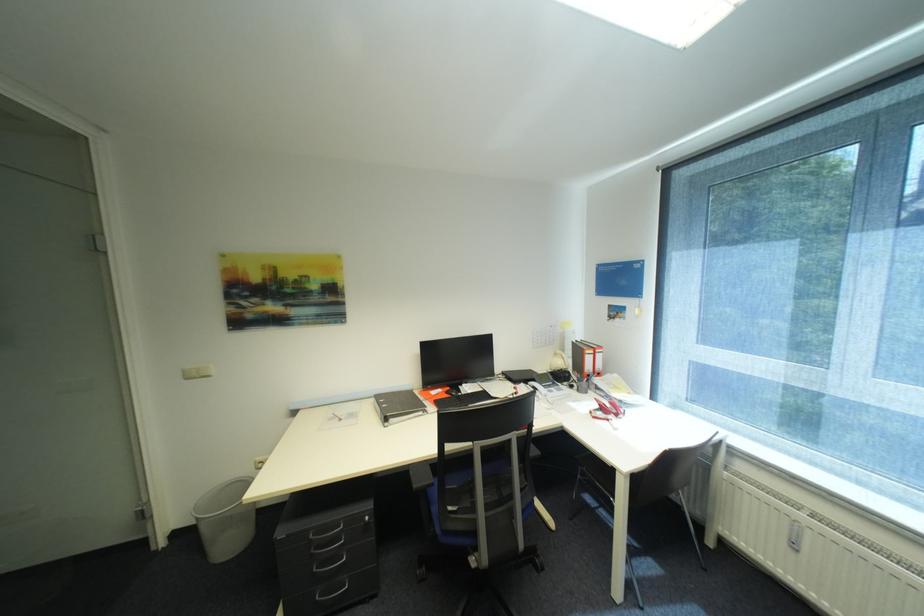
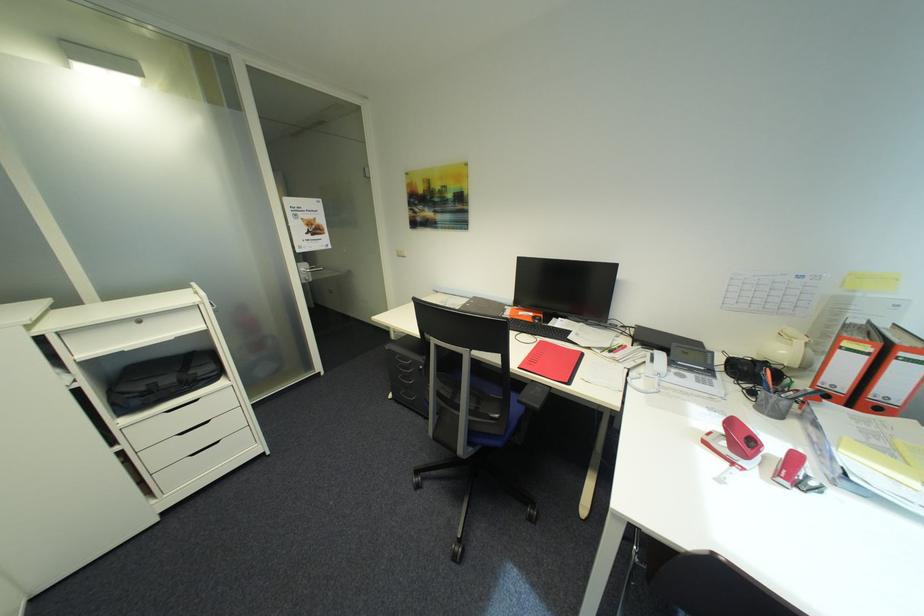
Where in the second image is the point corresponding to point (323, 570) from the first image?

(408, 378)